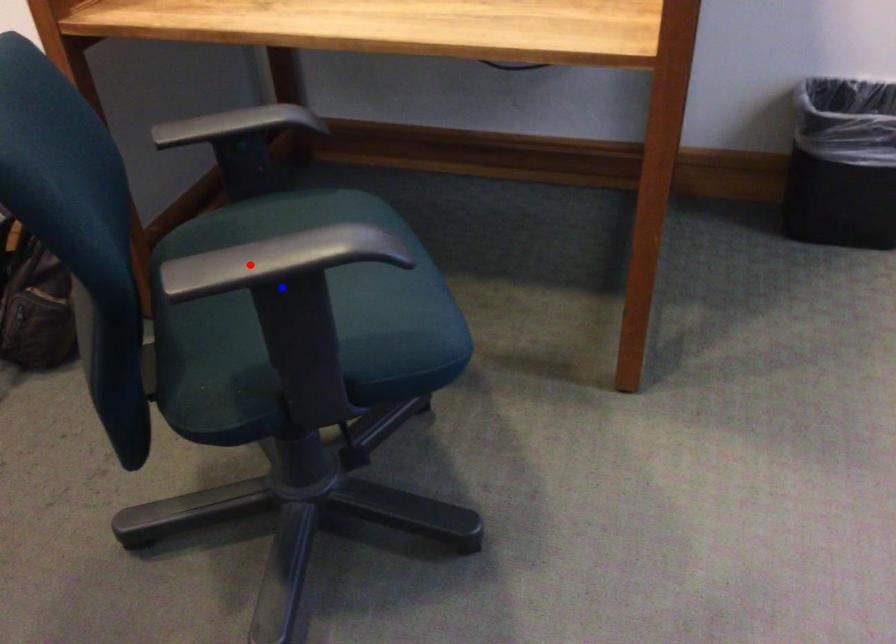
Question: Two points are marked on the image. Which point is closer to the camera?

Choices:
 (A) Blue point is closer.
 (B) Red point is closer.

Answer: (B)